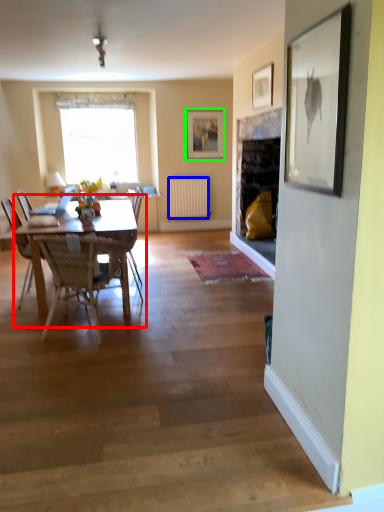
Question: Considering the real-world distances, which object is farthest from kitchen & dining room table (highlighted by a red box)? radiator (highlighted by a blue box) or picture frame (highlighted by a green box)?

Choices:
 (A) radiator
 (B) picture frame

Answer: (B)